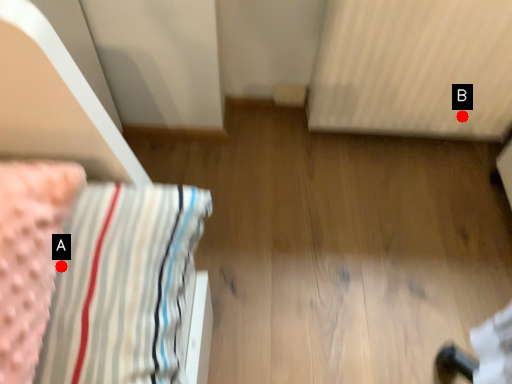
Question: Two points are circled on the image, labeled by A and B beside each circle. Which of the following is the closest to the observer?

Choices:
 (A) A is closer
 (B) B is closer

Answer: (A)